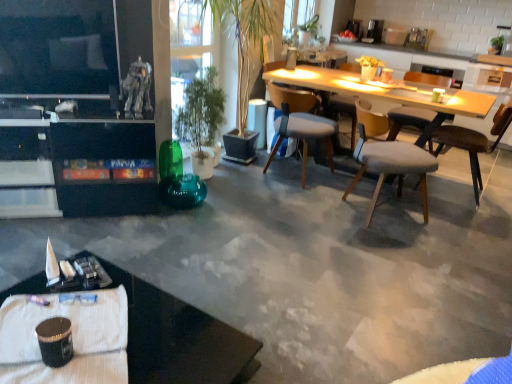
Question: From the image's perspective, is green glossy plant at center over light gray fabric chair at center right, which is counted as the second chair, starting from the right?

Choices:
 (A) no
 (B) yes

Answer: (B)

Question: Does green glossy plant at center lie behind light gray fabric chair at center right, which is counted as the second chair, starting from the right?

Choices:
 (A) yes
 (B) no

Answer: (B)

Question: Does green glossy plant at center appear on the right side of light gray fabric chair at center right, which is counted as the second chair, starting from the right?

Choices:
 (A) no
 (B) yes

Answer: (A)

Question: Is light gray fabric chair at center right, which is counted as the second chair, starting from the right, located within green glossy plant at center?

Choices:
 (A) no
 (B) yes

Answer: (A)

Question: Is green glossy plant at center thinner than light gray fabric chair at center right, which is counted as the second chair, starting from the right?

Choices:
 (A) yes
 (B) no

Answer: (B)

Question: Is green glossy plant at center shorter than light gray fabric chair at center right, marked as the third chair in a left-to-right arrangement?

Choices:
 (A) yes
 (B) no

Answer: (B)

Question: Can you confirm if black glossy desk at lower left is positioned to the right of metallic pen at lower left?

Choices:
 (A) yes
 (B) no

Answer: (A)

Question: Can you confirm if black glossy desk at lower left is taller than metallic pen at lower left?

Choices:
 (A) yes
 (B) no

Answer: (A)

Question: From the image's perspective, is black glossy desk at lower left over metallic pen at lower left?

Choices:
 (A) no
 (B) yes

Answer: (A)

Question: Is black glossy desk at lower left smaller than metallic pen at lower left?

Choices:
 (A) no
 (B) yes

Answer: (A)

Question: Would you say black glossy desk at lower left is a long distance from metallic pen at lower left?

Choices:
 (A) no
 (B) yes

Answer: (A)

Question: Is black glossy desk at lower left looking in the opposite direction of metallic pen at lower left?

Choices:
 (A) no
 (B) yes

Answer: (A)

Question: Is light gray fabric chair at center right, marked as the third chair in a left-to-right arrangement, completely or partially inside light gray fabric chair at center, acting as the 3th chair starting from the right?

Choices:
 (A) yes
 (B) no

Answer: (B)